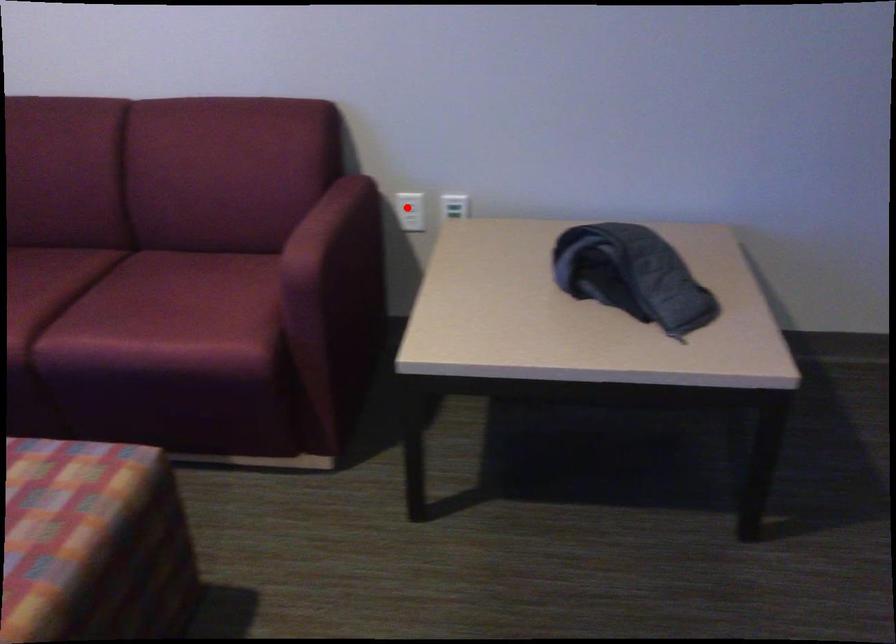
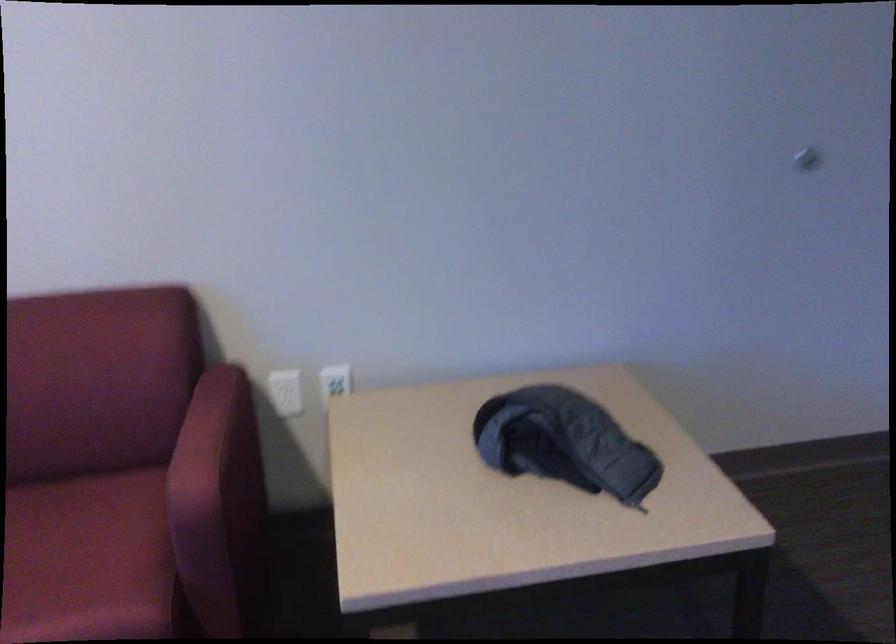
In the second image, find the point that corresponds to the highlighted location in the first image.

(286, 392)